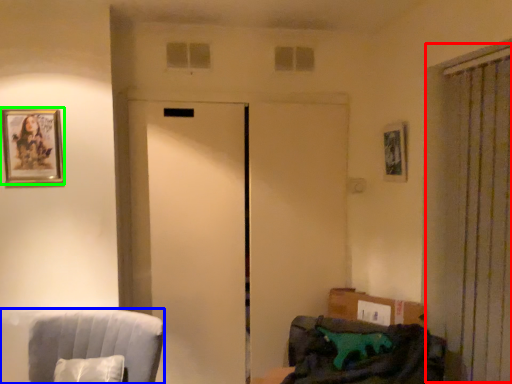
Question: Considering the real-world distances, which object is farthest from curtain (highlighted by a red box)? furniture (highlighted by a blue box) or picture frame (highlighted by a green box)?

Choices:
 (A) furniture
 (B) picture frame

Answer: (B)